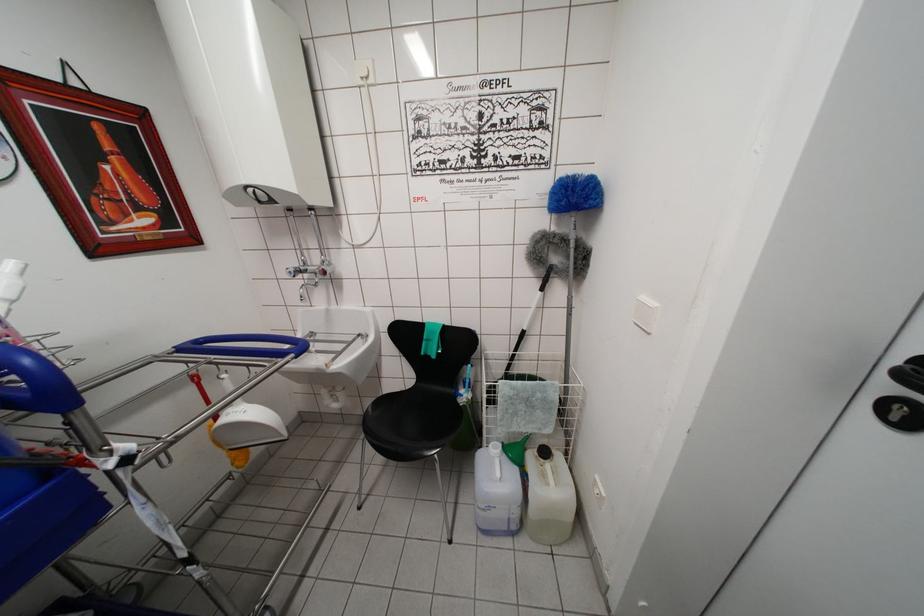
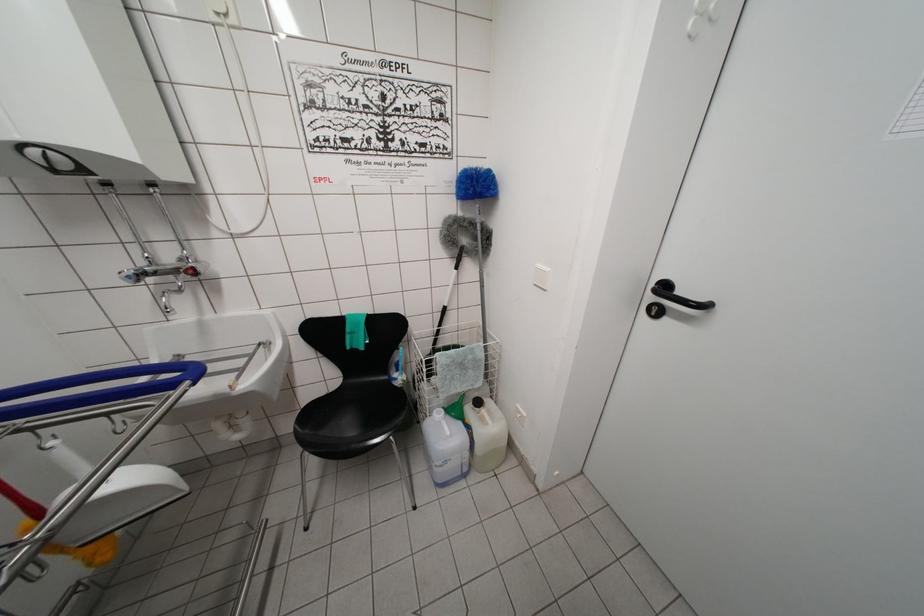
Find the pixel in the second image that matches the point at 648,302 in the first image.

(542, 270)